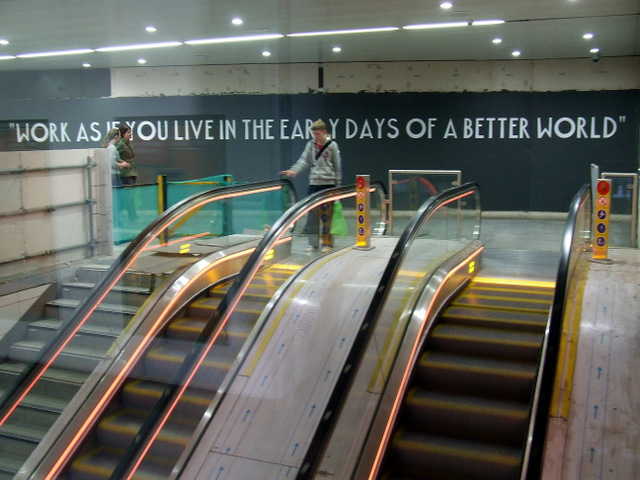
This screenshot has width=640, height=480. Identify the location of yellow lights. (268, 256), (473, 267), (185, 248).